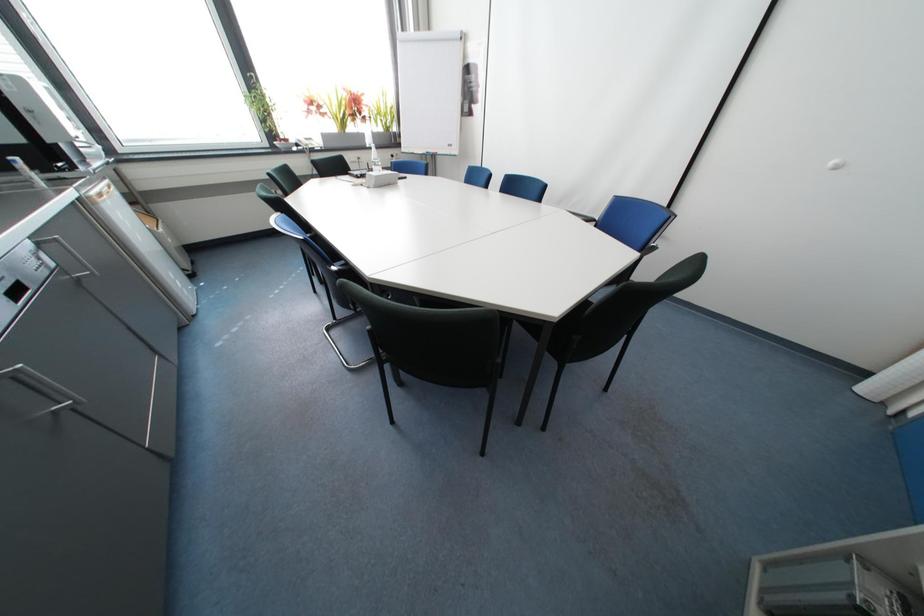
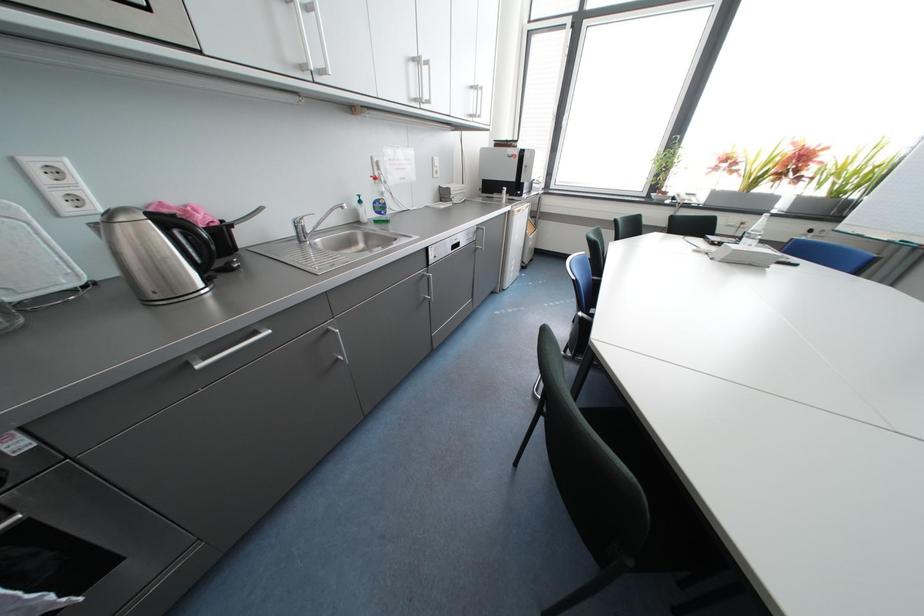
Question: The images are taken continuously from a first-person perspective. In which direction is your viewpoint rotating?

Choices:
 (A) Left
 (B) Right
 (C) Up
 (D) Down

Answer: (A)